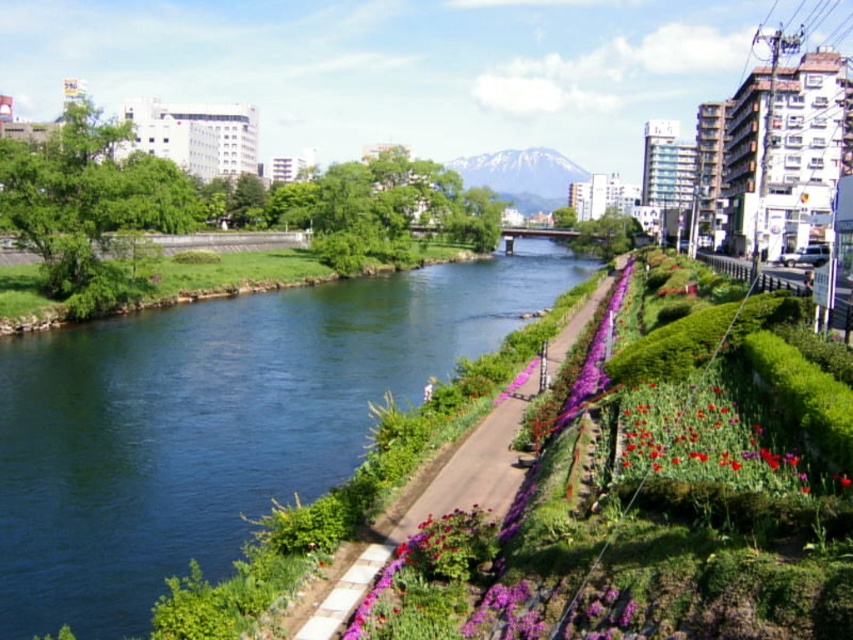
Question: Where is green smooth water at center located in relation to green grassy path at center in the image?

Choices:
 (A) left
 (B) right

Answer: (A)

Question: Is green smooth water at center bigger than green grassy path at center?

Choices:
 (A) no
 (B) yes

Answer: (B)

Question: Is green smooth water at center above green grassy path at center?

Choices:
 (A) yes
 (B) no

Answer: (A)

Question: Among these points, which one is nearest to the camera?

Choices:
 (A) (366, 579)
 (B) (569, 273)

Answer: (A)